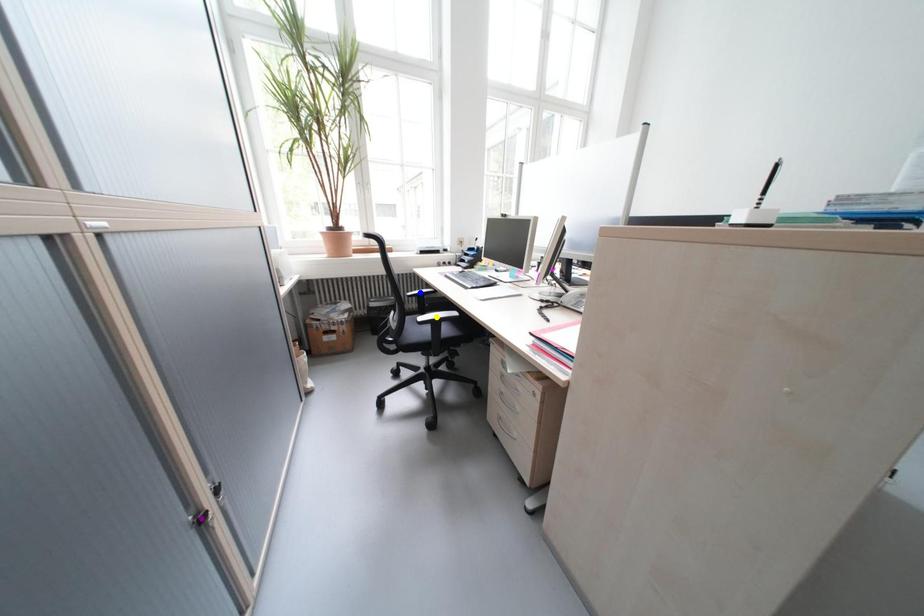
Order these from nearest to farthest:
yellow point, blue point, purple point

purple point < yellow point < blue point